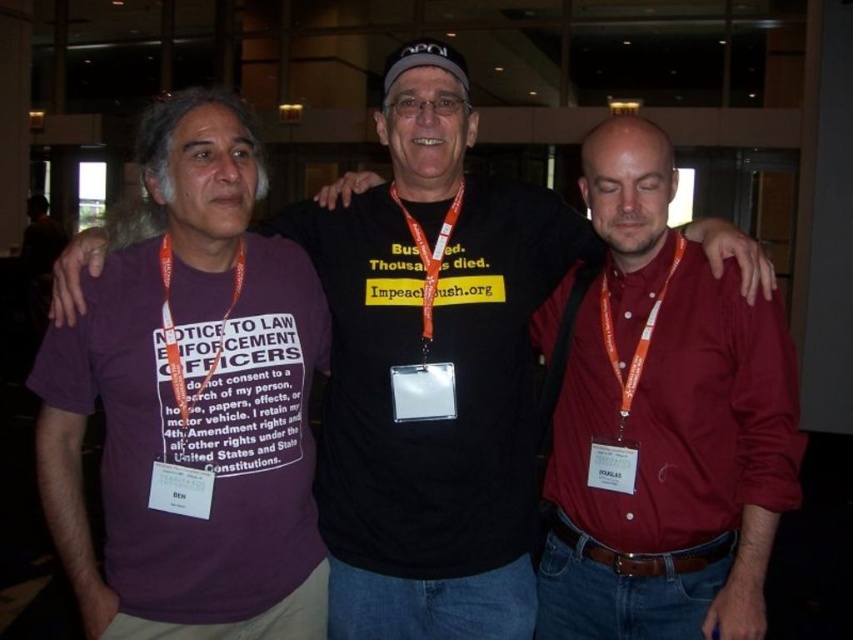
Question: Which of the following is the closest to the observer?

Choices:
 (A) orange lanyard at left
 (B) purple cotton t-shirt at left
 (C) clear plastic badge at center

Answer: (B)

Question: Which of these objects is positioned closest to the clear plastic badge at center?

Choices:
 (A) matte red shirt at center
 (B) purple cotton t-shirt at left
 (C) orange lanyard at left

Answer: (B)

Question: Is purple cotton t-shirt at left thinner than clear plastic badge at center?

Choices:
 (A) yes
 (B) no

Answer: (B)

Question: Based on their relative distances, which object is nearer to the matte red shirt at center?

Choices:
 (A) purple cotton t-shirt at left
 (B) orange lanyard at left
 (C) clear plastic badge at center

Answer: (C)

Question: Does matte red shirt at center have a lesser width compared to orange lanyard at left?

Choices:
 (A) yes
 (B) no

Answer: (B)

Question: From the image, what is the correct spatial relationship of orange lanyard at left in relation to clear plastic badge at center?

Choices:
 (A) right
 (B) left

Answer: (B)